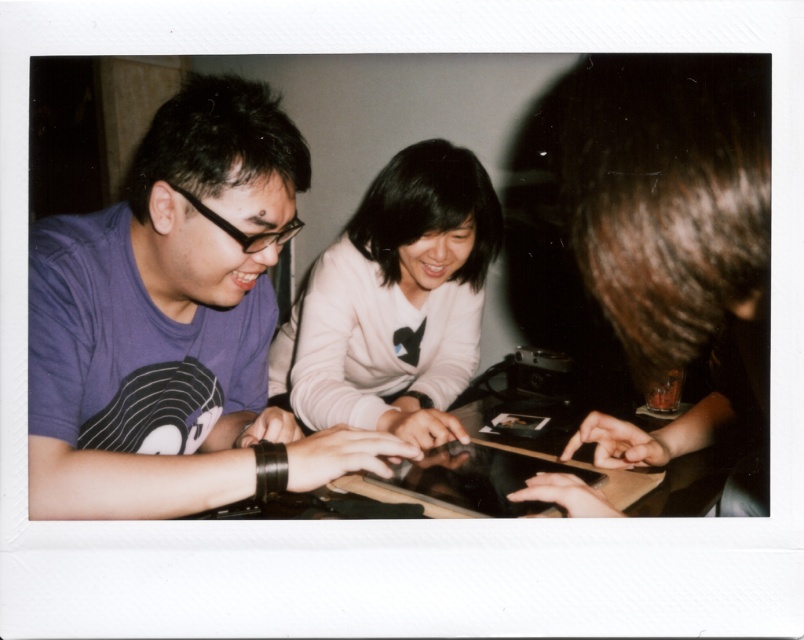
Question: Which point is closer to the camera?

Choices:
 (A) (243, 241)
 (B) (380, 362)

Answer: (A)

Question: Is purple matte shirt at left below white soft sweater at center?

Choices:
 (A) no
 (B) yes

Answer: (A)

Question: Does purple matte shirt at left appear on the left side of white soft sweater at center?

Choices:
 (A) yes
 (B) no

Answer: (A)

Question: Which point is closer to the camera taking this photo?

Choices:
 (A) (273, 116)
 (B) (277, 360)

Answer: (A)

Question: Can you confirm if purple matte shirt at left is smaller than white soft sweater at center?

Choices:
 (A) no
 (B) yes

Answer: (B)